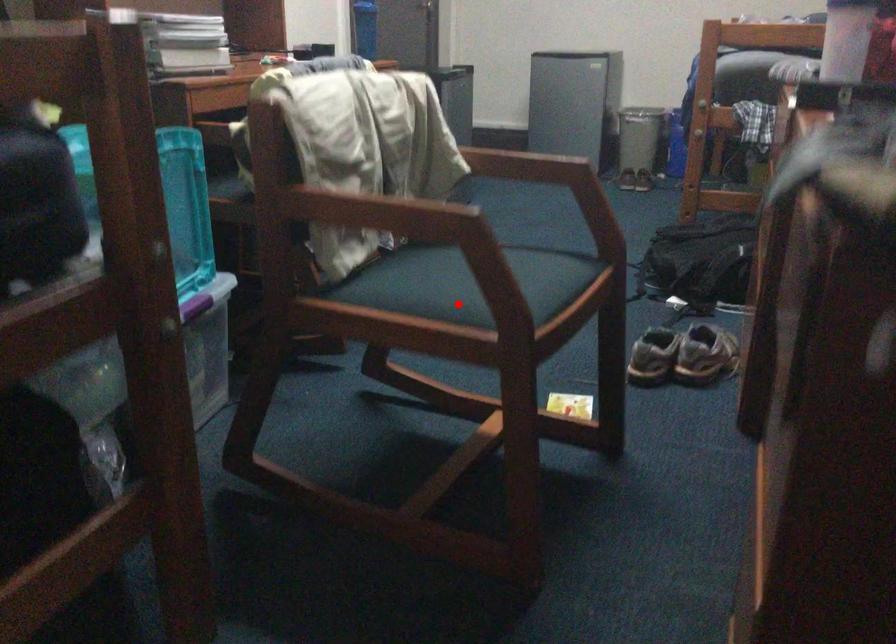
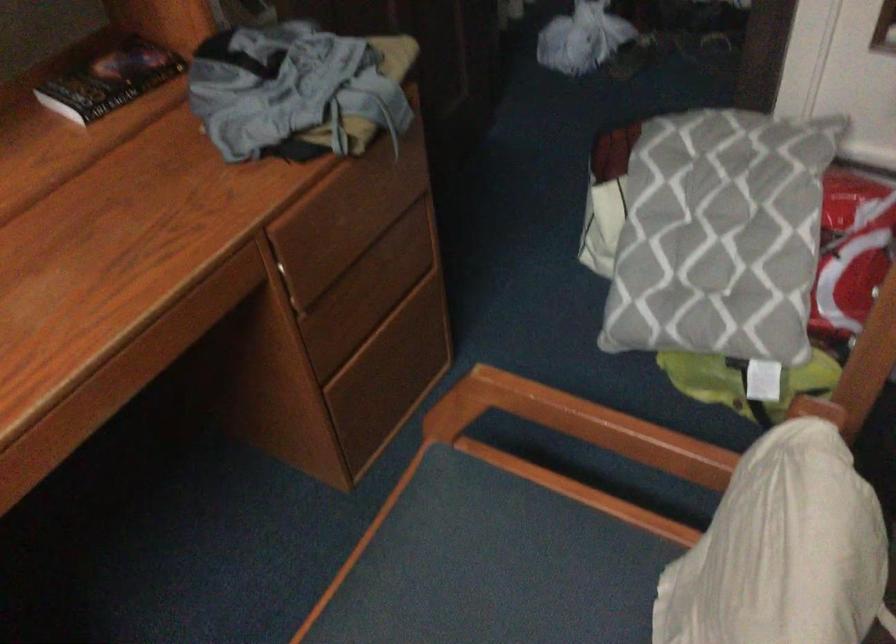
Locate, in the second image, the point that corresponds to the highlighted location in the first image.

(549, 580)